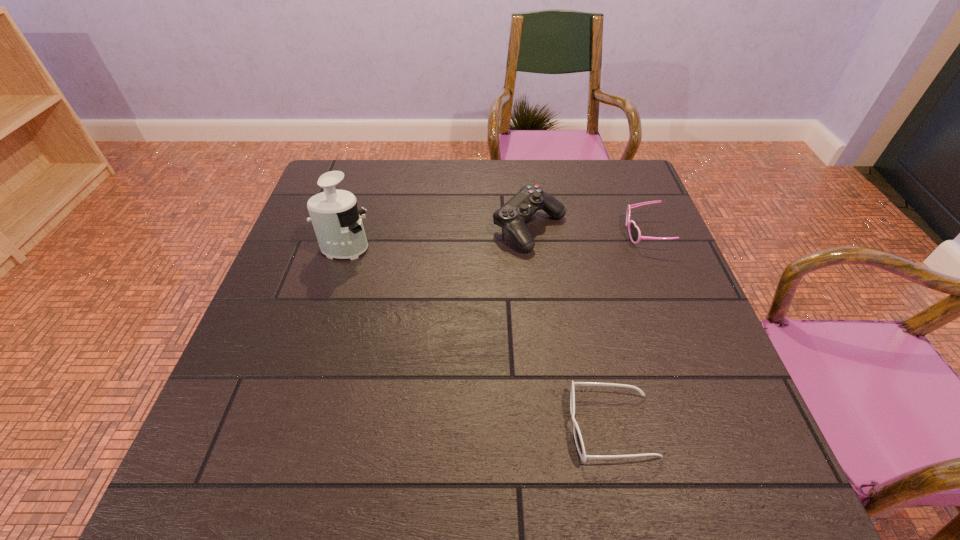
Find the location of a particular element. This screenshot has width=960, height=540. the leftmost object is located at coordinates (337, 223).

You are a GUI agent. You are given a task and a screenshot of the screen. Output one action in this format:
    pyautogui.click(x=<x>, y=<y>)
    Task: Click on the juicer
    This screenshot has height=540, width=960.
    Given the screenshot: What is the action you would take?
    pyautogui.click(x=337, y=223)

What are the coordinates of `control` in the screenshot? It's located at (512, 216).

Identify the location of the right sunglasses. This screenshot has width=960, height=540. (634, 232).

This screenshot has width=960, height=540. I want to click on the second shortest object, so click(x=634, y=232).

You are a GUI agent. You are given a task and a screenshot of the screen. Output one action in this format:
    pyautogui.click(x=<x>, y=<y>)
    Task: Click on the nearer sunglasses
    
    Given the screenshot: What is the action you would take?
    pyautogui.click(x=577, y=434)

You are a GUI agent. You are given a task and a screenshot of the screen. Output one action in this format:
    pyautogui.click(x=<x>, y=<y>)
    Task: Click on the shorter sunglasses
    
    Given the screenshot: What is the action you would take?
    pyautogui.click(x=577, y=434)

Image resolution: width=960 pixels, height=540 pixels. What are the coordinates of `vacant space located 0.100m on the front of the leftmost object` in the screenshot? It's located at (331, 291).

The image size is (960, 540). I want to click on free space located 0.120m on the back of the third shortest object, so tap(524, 181).

This screenshot has height=540, width=960. Find the location of `free point located on the front-facing side of the rightmost object`. free point located on the front-facing side of the rightmost object is located at coordinates (565, 234).